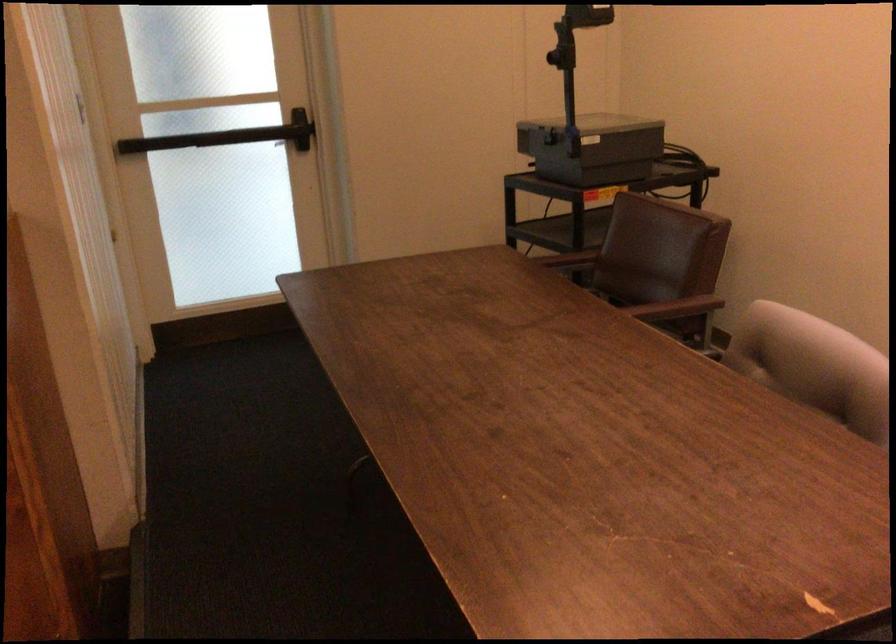
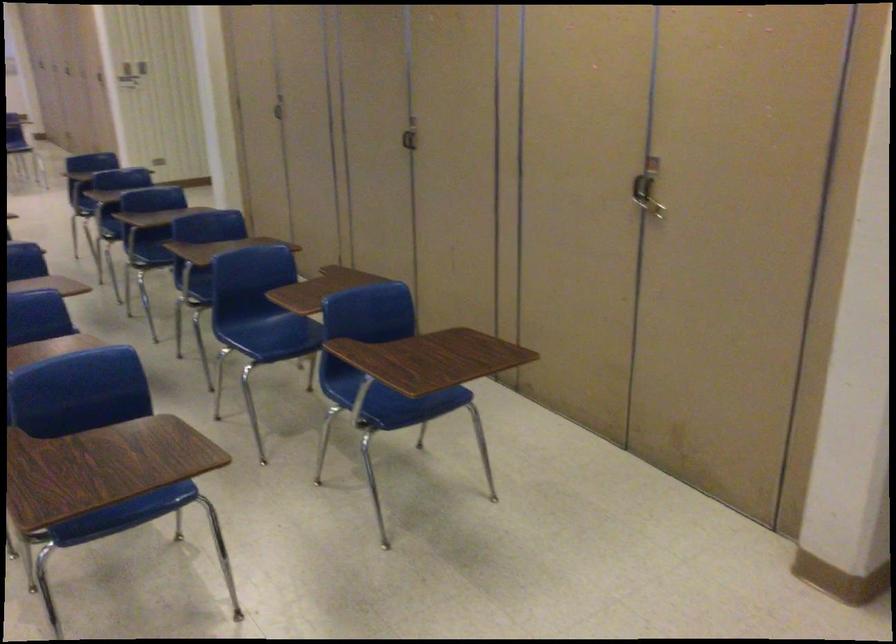
The images are taken continuously from a first-person perspective. In which direction is your viewpoint rotating?

The rotation direction of the camera is left-down.